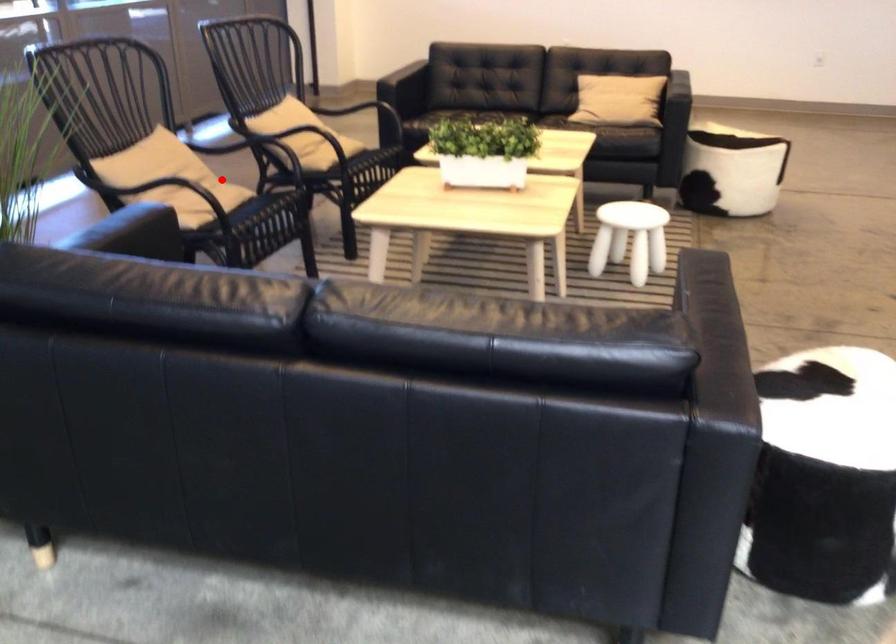
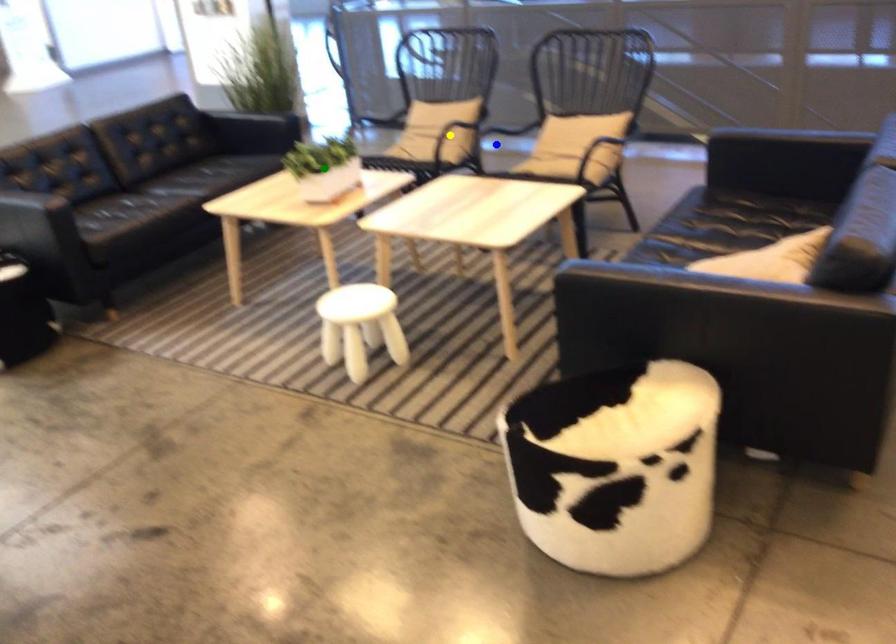
Question: I am providing you with two images of the same scene from different viewpoints. A red point is marked on the first image. You are given multiple points on the second image. Which point in image 2 is actually the same real-world point as the red point in image 1?

Choices:
 (A) yellow point
 (B) green point
 (C) blue point

Answer: (A)